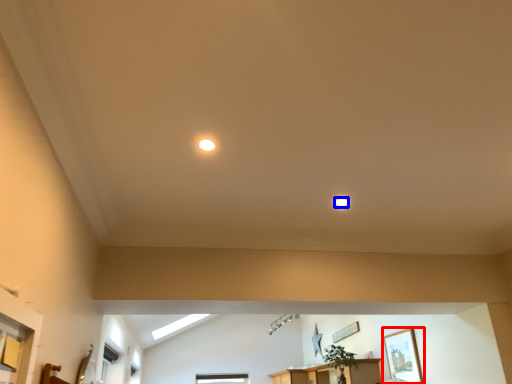
Question: Which point is further to the camera, picture frame (highlighted by a red box) or lighting (highlighted by a blue box)?

Choices:
 (A) picture frame
 (B) lighting

Answer: (A)